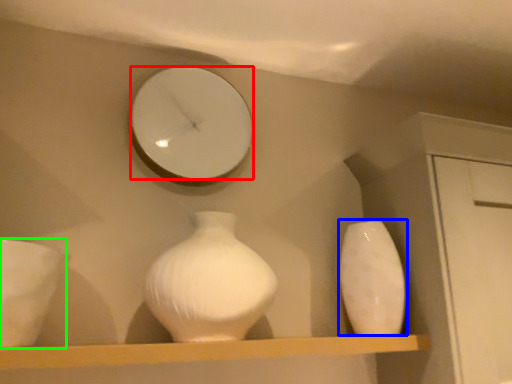
Question: Based on their relative distances, which object is farther from mirror (highlighted by a red box)? Choose from vase (highlighted by a blue box) and porcelain (highlighted by a green box).

Choices:
 (A) vase
 (B) porcelain

Answer: (A)